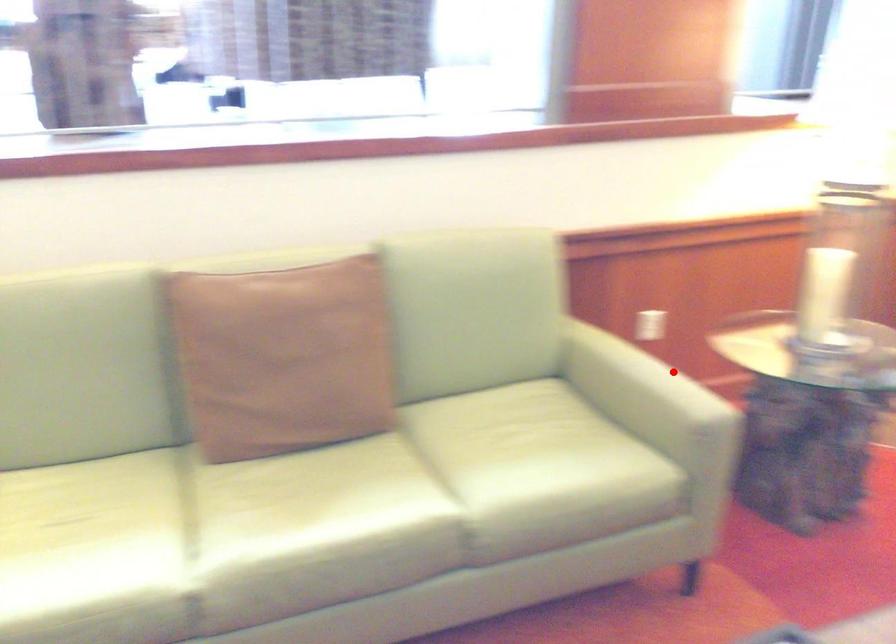
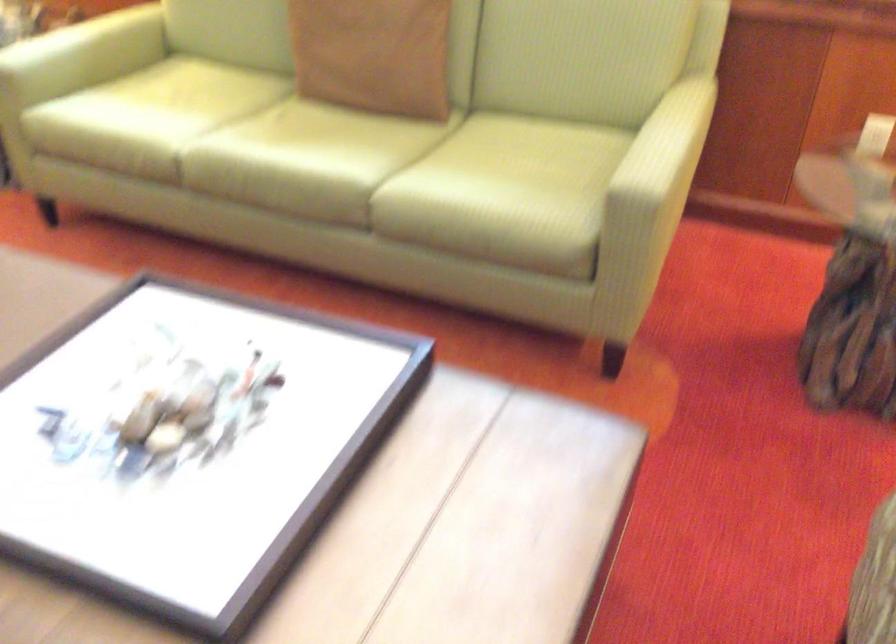
In the second image, find the point that corresponds to the highlighted location in the first image.

(668, 142)